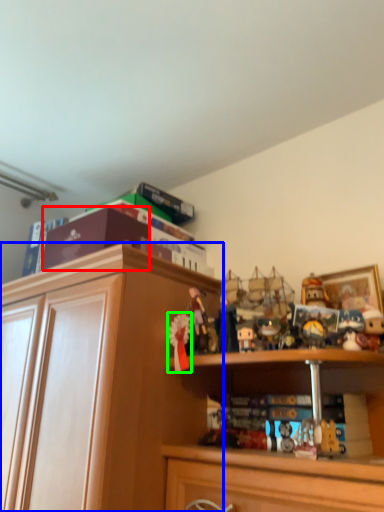
Question: Considering the real-world distances, which object is closest to book (highlighted by a red box)? cabinetry (highlighted by a blue box) or toy (highlighted by a green box).

Choices:
 (A) cabinetry
 (B) toy

Answer: (A)